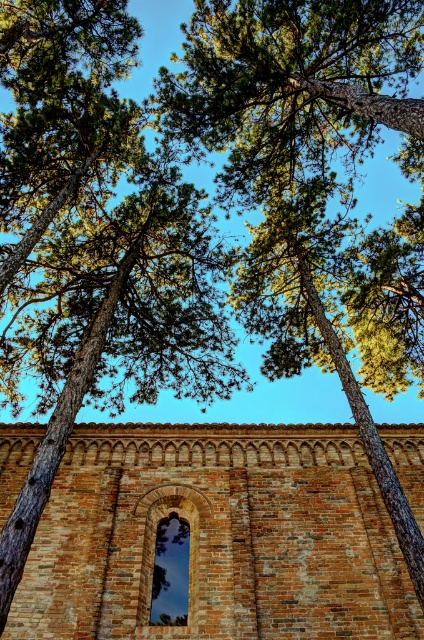
You are an architect designing a new garden pathway. You need to place a bench between the brown brick church at center and the dark glass window at center. Which object should the bench be closer to if you want it to be farther from the wider structure?

The bench should be closer to the dark glass window at center because the brown brick church at center might be wider, so placing the bench near the narrower dark glass window at center keeps it farther from the wider structure.

You are standing in the outdoor scene looking up at the brick wall with arched windows. You notice two points marked on the wall. Which point is closer to you, point (137, 536) or point (156, 605)?

Point (137, 536) is closer to you because it is further to the viewer than point (156, 605).

You are standing in the middle of a forest path and see the brown brick church at center. If you want to walk directly towards it, which direction should you move relative to your current position?

Since the brown brick church at center is located at point 0.839 on the x axis and 0.512 on the y axis, you should move towards the right direction to reach it.